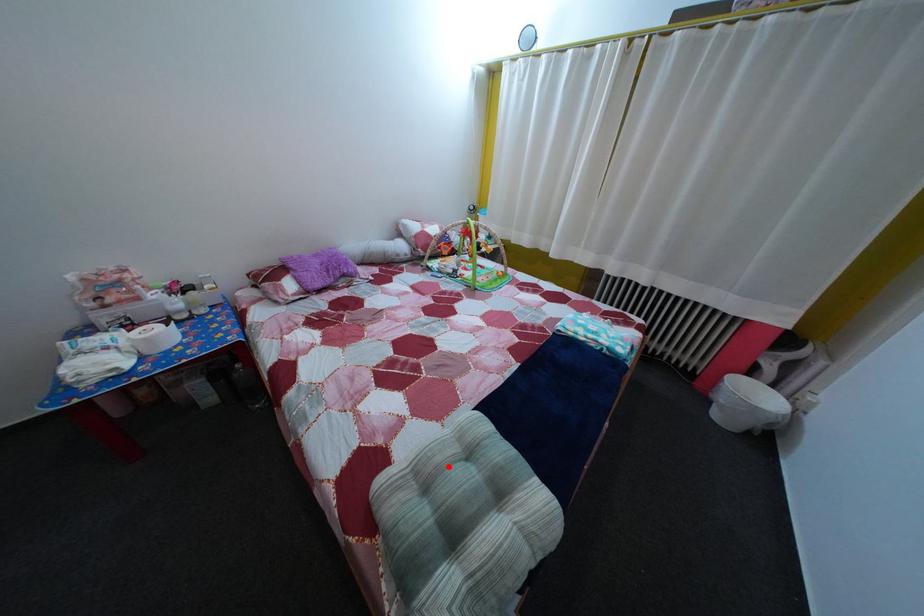
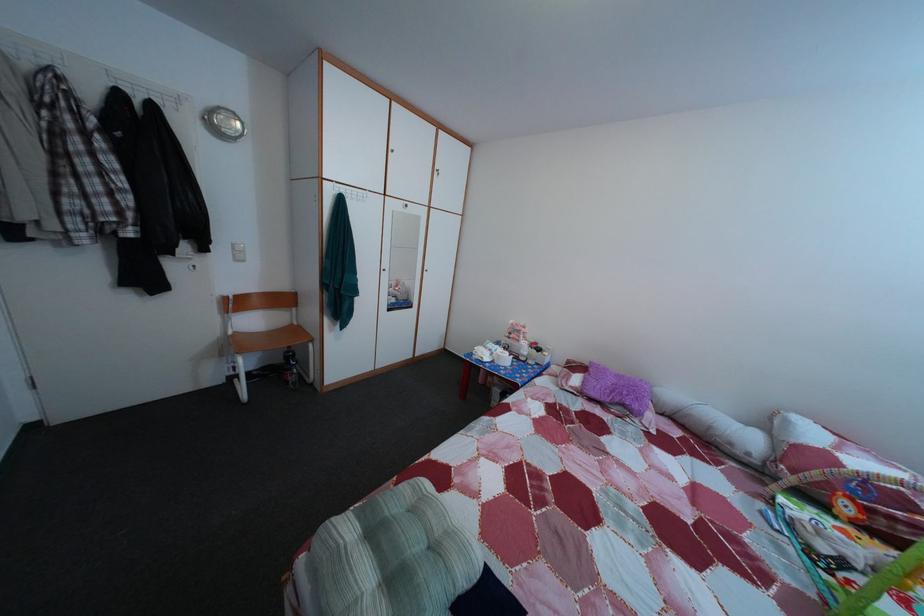
Where in the second image is the point corresponding to the highlighted location from the first image?

(440, 521)